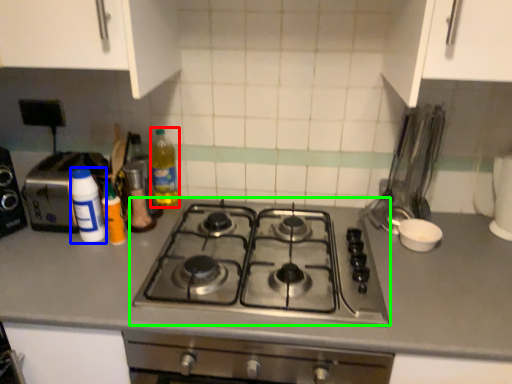
Question: Which object is positioned farthest from bottle (highlighted by a red box)? Select from bottle (highlighted by a blue box) and gas stove (highlighted by a green box).

Choices:
 (A) bottle
 (B) gas stove

Answer: (B)